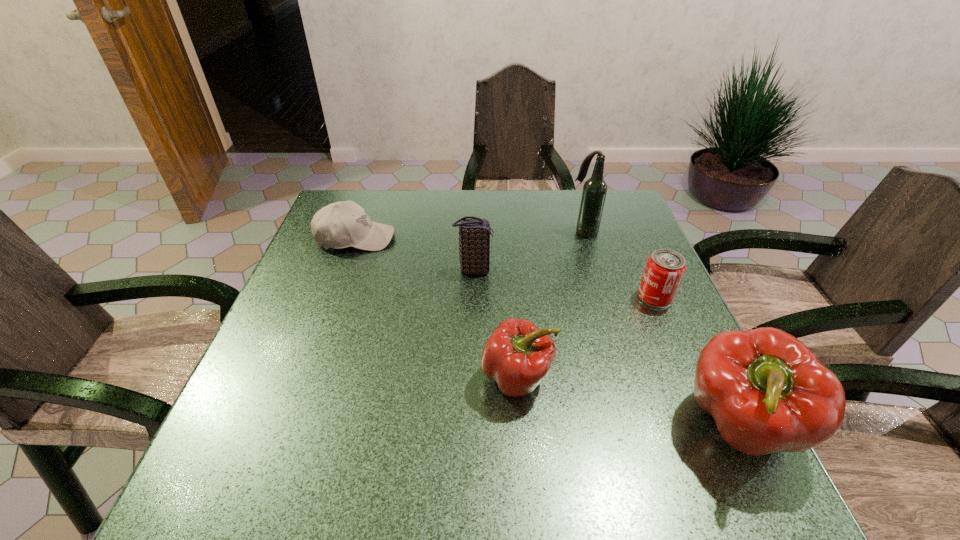
The height and width of the screenshot is (540, 960). Find the location of `free space located 0.390m on the left of the can`. free space located 0.390m on the left of the can is located at coordinates (474, 297).

The width and height of the screenshot is (960, 540). What are the coordinates of `vacant space located on the front of the third object from right to left` in the screenshot? It's located at (590, 254).

Locate an element on the screen. The image size is (960, 540). vacant space located 0.230m with the zip open on the fourth nearest object is located at coordinates (583, 270).

Where is `vacant position located 0.390m on the front-facing side of the leftmost object`? The width and height of the screenshot is (960, 540). vacant position located 0.390m on the front-facing side of the leftmost object is located at coordinates (534, 238).

Identify the location of beer bottle that is at the far edge. The image size is (960, 540). (594, 191).

I want to click on baseball cap present at the far edge, so point(345,224).

Image resolution: width=960 pixels, height=540 pixels. In order to click on object that is at the left edge in this screenshot , I will do `click(345, 224)`.

The image size is (960, 540). I want to click on pepper present at the right edge, so click(766, 390).

Find the location of a particular element. Image resolution: width=960 pixels, height=540 pixels. can that is at the right edge is located at coordinates (665, 268).

Locate an element on the screen. The image size is (960, 540). beer bottle present at the right edge is located at coordinates (594, 191).